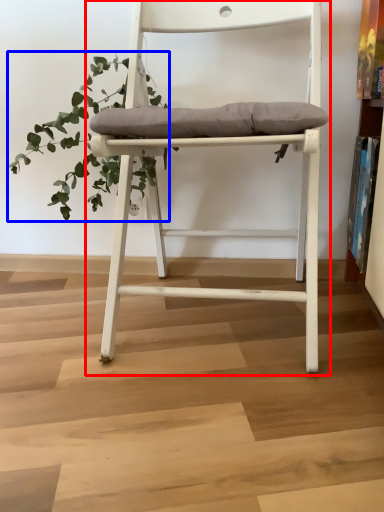
Question: Which point is further to the camera, chair (highlighted by a red box) or vegetation (highlighted by a blue box)?

Choices:
 (A) chair
 (B) vegetation

Answer: (B)